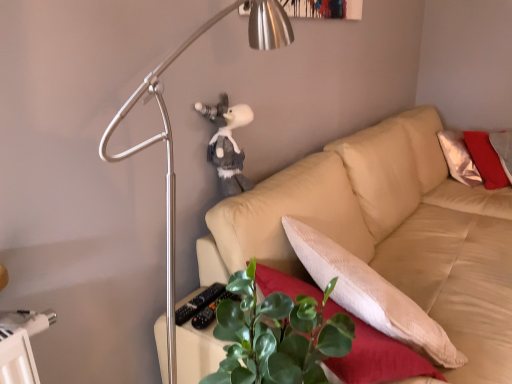
Question: Is point (241, 297) positioned closer to the camera than point (117, 115)?

Choices:
 (A) closer
 (B) farther

Answer: (A)

Question: From a real-world perspective, is green leafy plant at lower center above or below metallic silver lamp at upper left?

Choices:
 (A) above
 (B) below

Answer: (B)

Question: Which object is the farthest from the white plush toy at upper center?

Choices:
 (A) metallic silver lamp at upper left
 (B) green leafy plant at lower center
 (C) beige fabric couch at center

Answer: (B)

Question: Which object is the farthest from the white plush toy at upper center?

Choices:
 (A) beige fabric couch at center
 (B) metallic silver lamp at upper left
 (C) green leafy plant at lower center

Answer: (C)